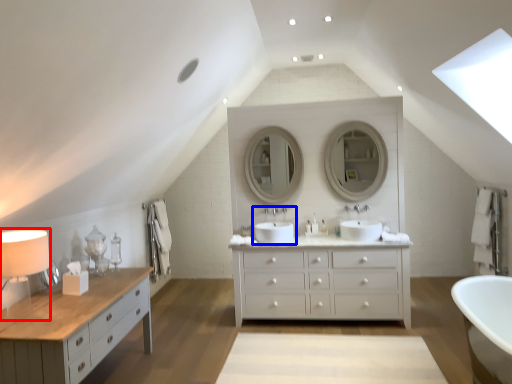
Question: Which point is further to the camera, table lamp (highlighted by a red box) or sink (highlighted by a blue box)?

Choices:
 (A) table lamp
 (B) sink

Answer: (B)